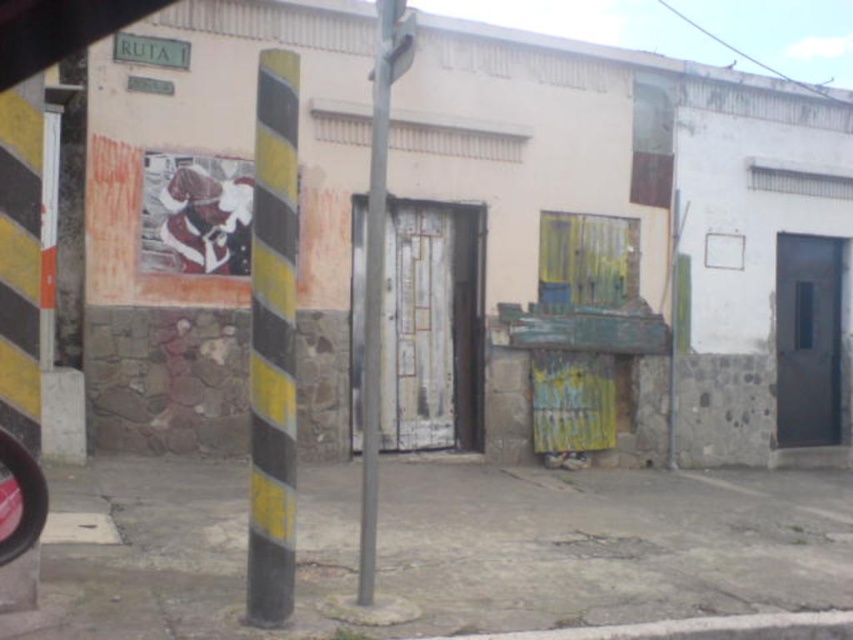
Who is higher up, concrete pavement at center or green plastic sign at upper left?

green plastic sign at upper left is above.

Is concrete pavement at center below green plastic sign at upper left?

Indeed, concrete pavement at center is positioned under green plastic sign at upper left.

Is point (235, 608) positioned behind point (154, 45)?

No, it is in front of (154, 45).

Image resolution: width=853 pixels, height=640 pixels. What are the coordinates of `concrete pavement at center` in the screenshot? It's located at (607, 545).

Can you confirm if concrete pavement at center is shorter than yellow/black striped pole at left?

Yes.

Does concrete pavement at center lie in front of yellow/black striped pole at left?

That is False.

Who is more distant from viewer, (692, 598) or (279, 157)?

Positioned behind is point (692, 598).

Locate an element on the screen. The height and width of the screenshot is (640, 853). concrete pavement at center is located at coordinates (607, 545).

Who is positioned more to the right, yellow/black striped pole at left or green plastic sign at upper left?

yellow/black striped pole at left

Is point (265, 400) behind point (149, 54)?

No, it is in front of (149, 54).

I want to click on yellow/black striped pole at left, so click(x=273, y=340).